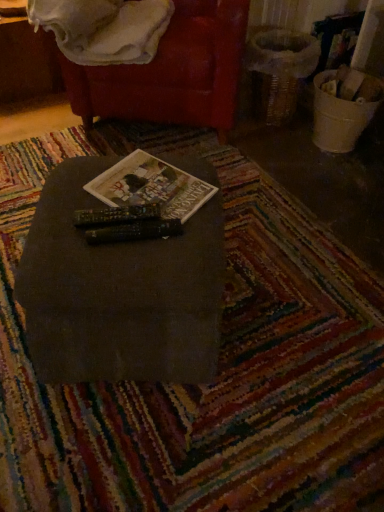
Question: Is hardcover book at center oriented away from velvet red bean bag chair at upper center?

Choices:
 (A) yes
 (B) no

Answer: (B)

Question: From the image's perspective, is hardcover book at center beneath velvet red bean bag chair at upper center?

Choices:
 (A) yes
 (B) no

Answer: (A)

Question: Does hardcover book at center have a lesser width compared to velvet red bean bag chair at upper center?

Choices:
 (A) yes
 (B) no

Answer: (A)

Question: Is hardcover book at center shorter than velvet red bean bag chair at upper center?

Choices:
 (A) yes
 (B) no

Answer: (A)

Question: From a real-world perspective, is hardcover book at center on top of velvet red bean bag chair at upper center?

Choices:
 (A) no
 (B) yes

Answer: (B)

Question: Does hardcover book at center have a greater width compared to velvet red bean bag chair at upper center?

Choices:
 (A) yes
 (B) no

Answer: (B)

Question: Is velvet red bean bag chair at upper center bigger than hardcover book at center?

Choices:
 (A) no
 (B) yes

Answer: (B)

Question: Is velvet red bean bag chair at upper center thinner than hardcover book at center?

Choices:
 (A) yes
 (B) no

Answer: (B)

Question: Is hardcover book at center surrounded by velvet red bean bag chair at upper center?

Choices:
 (A) yes
 (B) no

Answer: (B)

Question: Are velvet red bean bag chair at upper center and hardcover book at center located far from each other?

Choices:
 (A) yes
 (B) no

Answer: (B)

Question: From a real-world perspective, is velvet red bean bag chair at upper center on top of hardcover book at center?

Choices:
 (A) yes
 (B) no

Answer: (B)

Question: Could you tell me if velvet red bean bag chair at upper center is turned towards hardcover book at center?

Choices:
 (A) yes
 (B) no

Answer: (A)

Question: Could you tell me if matte black table at center is turned towards white soft blanket at upper left?

Choices:
 (A) yes
 (B) no

Answer: (B)